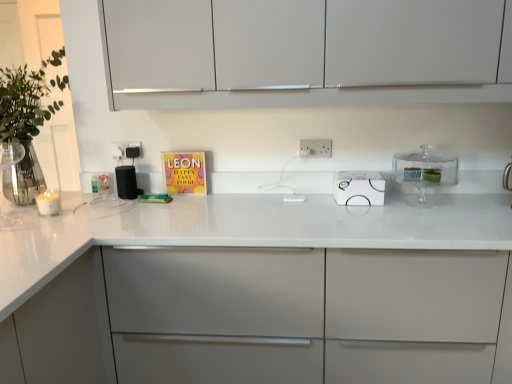
Question: Is black matte speaker at center smaller than white matte cabinet at center, marked as the 1th cabinetry in a bottom-to-top arrangement?

Choices:
 (A) yes
 (B) no

Answer: (A)

Question: From a real-world perspective, is black matte speaker at center physically below white matte cabinet at center, marked as the 1th cabinetry in a bottom-to-top arrangement?

Choices:
 (A) yes
 (B) no

Answer: (B)

Question: Can we say black matte speaker at center lies outside white matte cabinet at center, which is counted as the 2th cabinetry, starting from the top?

Choices:
 (A) yes
 (B) no

Answer: (B)

Question: From the image's perspective, does black matte speaker at center appear lower than white matte cabinet at center, which is counted as the 2th cabinetry, starting from the top?

Choices:
 (A) no
 (B) yes

Answer: (A)

Question: Considering the relative sizes of black matte speaker at center and white matte cabinet at center, which is counted as the 2th cabinetry, starting from the top, in the image provided, is black matte speaker at center taller than white matte cabinet at center, which is counted as the 2th cabinetry, starting from the top,?

Choices:
 (A) no
 (B) yes

Answer: (A)

Question: From the image's perspective, relative to white matte cabinet at center, marked as the 1th cabinetry in a bottom-to-top arrangement, is clear glass cake stand at right above or below?

Choices:
 (A) below
 (B) above

Answer: (B)

Question: Is point (394, 162) positioned closer to the camera than point (49, 297)?

Choices:
 (A) closer
 (B) farther

Answer: (B)

Question: Considering the positions of clear glass cake stand at right and white matte cabinet at center, marked as the 1th cabinetry in a bottom-to-top arrangement, in the image, is clear glass cake stand at right taller or shorter than white matte cabinet at center, marked as the 1th cabinetry in a bottom-to-top arrangement,?

Choices:
 (A) tall
 (B) short

Answer: (B)

Question: Is clear glass cake stand at right inside or outside of white matte cabinet at center, marked as the 1th cabinetry in a bottom-to-top arrangement?

Choices:
 (A) outside
 (B) inside

Answer: (B)

Question: Considering the relative positions of white glossy electric stove at center and green leafy plant at left in the image provided, is white glossy electric stove at center to the left or to the right of green leafy plant at left?

Choices:
 (A) right
 (B) left

Answer: (A)

Question: Is white glossy electric stove at center wider or thinner than green leafy plant at left?

Choices:
 (A) thin
 (B) wide

Answer: (A)

Question: In the image, is white glossy electric stove at center positioned in front of or behind green leafy plant at left?

Choices:
 (A) behind
 (B) front

Answer: (A)

Question: Is white glossy electric stove at center spatially inside green leafy plant at left, or outside of it?

Choices:
 (A) outside
 (B) inside

Answer: (A)

Question: Is white plastic electric outlet at center, which is the first electric outlet in left-to-right order, bigger or smaller than white glossy electric stove at center?

Choices:
 (A) small
 (B) big

Answer: (A)

Question: From the image's perspective, is white plastic electric outlet at center, placed as the 1th electric outlet when sorted from back to front, positioned above or below white glossy electric stove at center?

Choices:
 (A) above
 (B) below

Answer: (A)